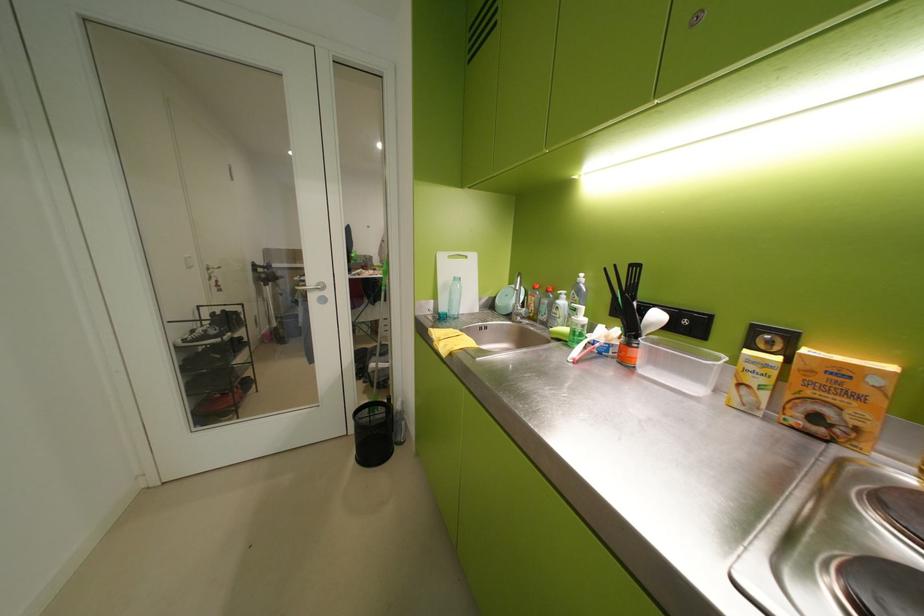
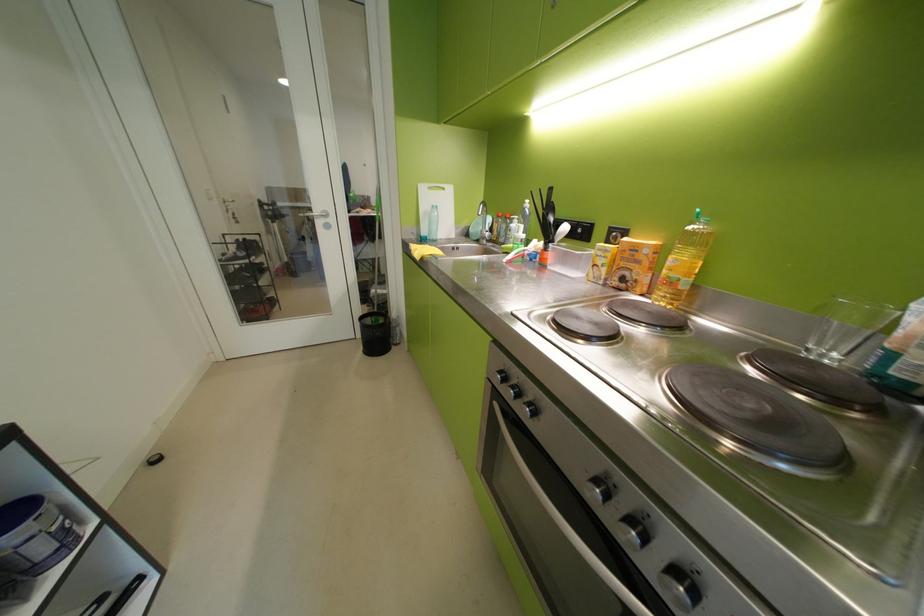
What movement of the cameraman would produce the second image?

Answer: The cameraman moved toward right, backward.